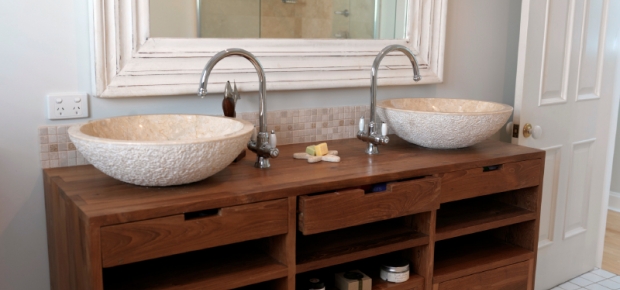
Where is `white surface of bowl sinks`? white surface of bowl sinks is located at coordinates (184, 161), (464, 131).